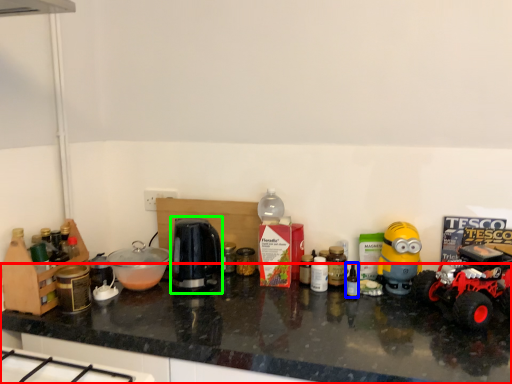
Question: Estimate the real-world distances between objects in this image. Which object is farther from countertop (highlighted by a red box), bottle (highlighted by a blue box) or coffee machine (highlighted by a green box)?

Choices:
 (A) bottle
 (B) coffee machine

Answer: (A)